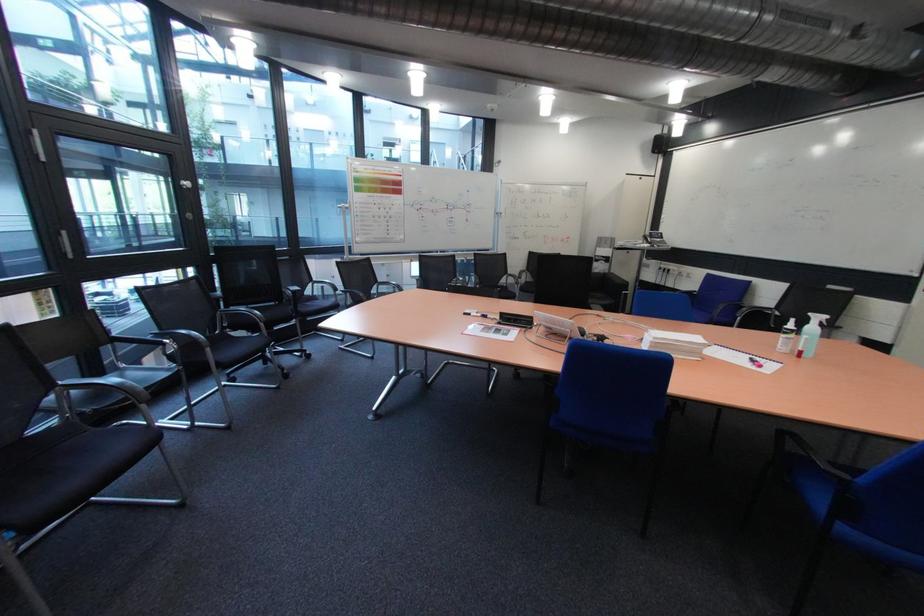
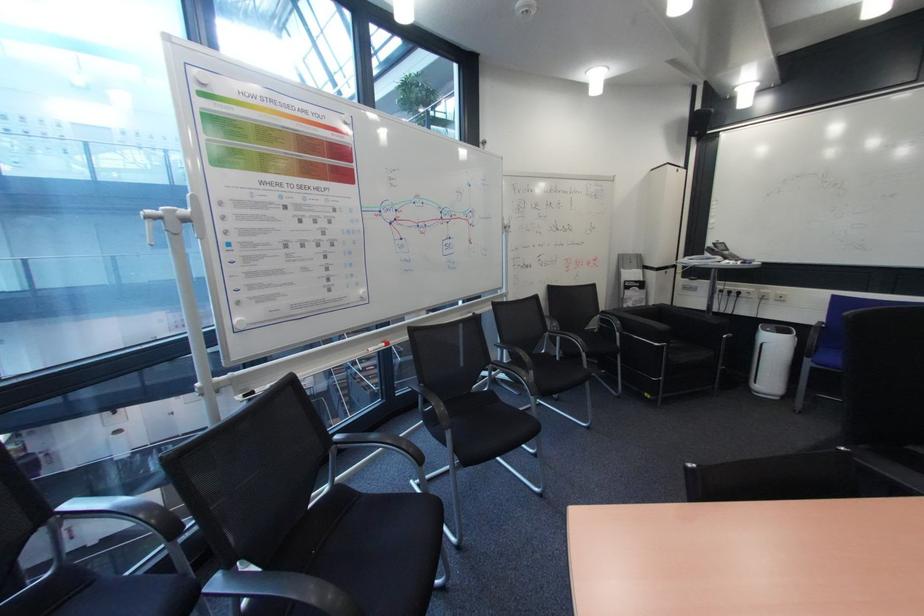
Which direction would the cameraman need to move to produce the second image?

The cameraman walked toward left, forward.